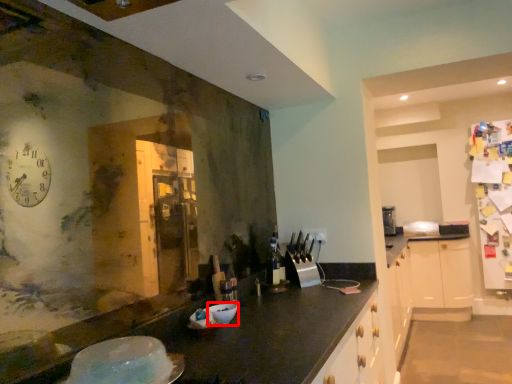
Question: From the image's perspective, where is bowl (annotated by the red box) located in relation to appliance in the image?

Choices:
 (A) below
 (B) above

Answer: (A)